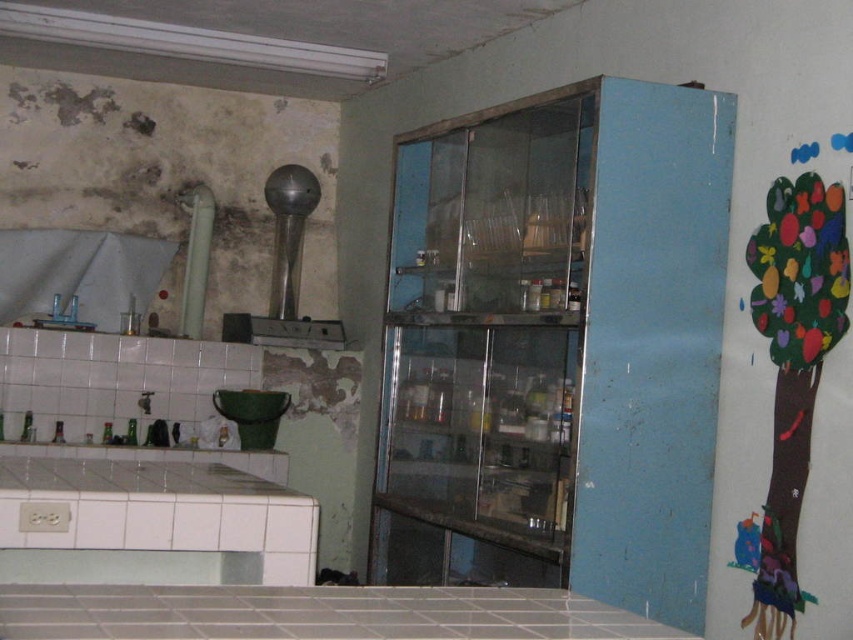
How far apart are white tile counter at lower left and white tile counter at lower center?

white tile counter at lower left is 25.28 inches away from white tile counter at lower center.

Does point (120, 528) come behind point (666, 637)?

Yes, point (120, 528) is farther from viewer.

The height and width of the screenshot is (640, 853). I want to click on white tile counter at lower left, so click(x=151, y=516).